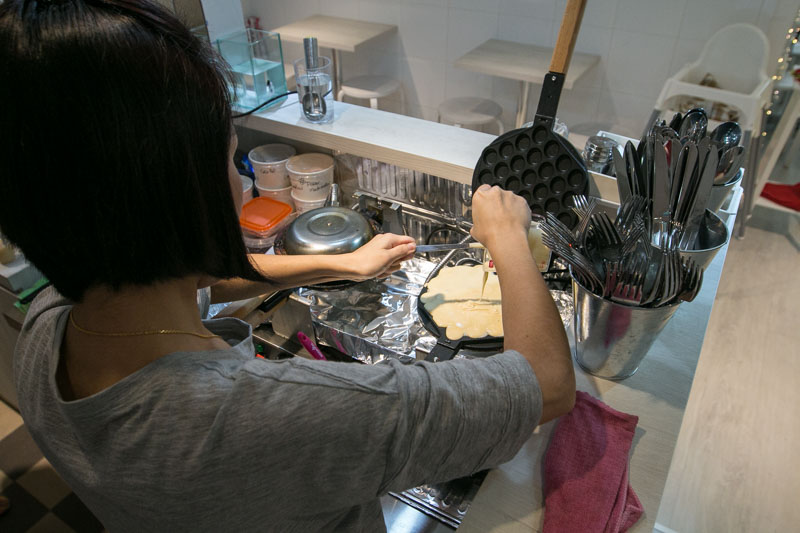
Where is `stool`? This screenshot has height=533, width=800. stool is located at coordinates (480, 109), (369, 86).